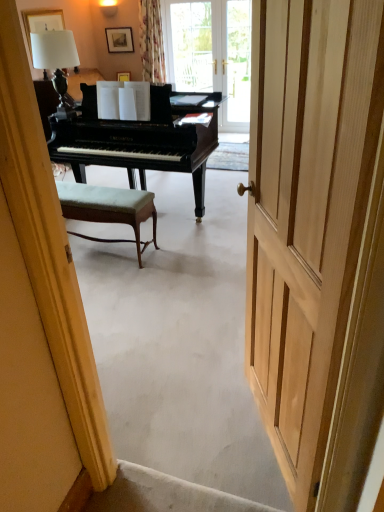
I want to click on free space on the front side of green fabric bench at center, so click(x=109, y=281).